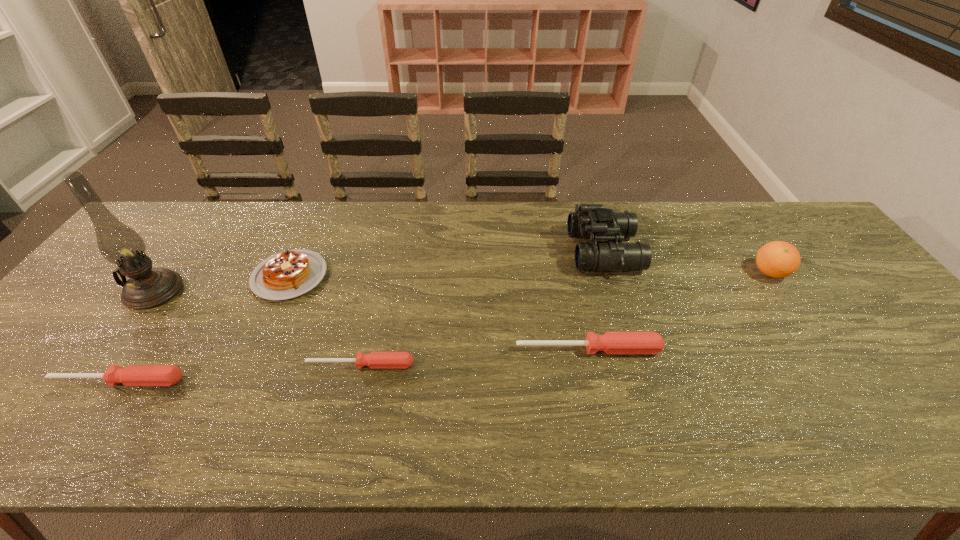
Identify the location of object that is at the far edge. (590, 221).

Where is `object that is at the near edge`? This screenshot has width=960, height=540. object that is at the near edge is located at coordinates (132, 375).

Where is `screwdriver located in the left edge section of the desktop`? This screenshot has height=540, width=960. screwdriver located in the left edge section of the desktop is located at coordinates (132, 375).

The height and width of the screenshot is (540, 960). I want to click on oil lamp present at the left edge, so click(147, 287).

Find the location of `object located at the near left corner`. object located at the near left corner is located at coordinates (132, 375).

Identify the location of vacant area at the far edge of the desktop. This screenshot has height=540, width=960. (418, 228).

In the image, there is a desktop. Identify the location of vacant space at the near edge. This screenshot has width=960, height=540. (217, 394).

In the image, there is a desktop. Identify the location of free space at the left edge. Image resolution: width=960 pixels, height=540 pixels. (84, 343).

At what (x,y) coordinates should I click in order to perform the action: click on free spot at the right edge of the desktop. Please return your answer as a coordinate pair (x, y). The width and height of the screenshot is (960, 540). Looking at the image, I should click on (855, 332).

Where is `empty space that is in between the rightmost screwdriver and the nearest object`? This screenshot has height=540, width=960. empty space that is in between the rightmost screwdriver and the nearest object is located at coordinates (353, 365).